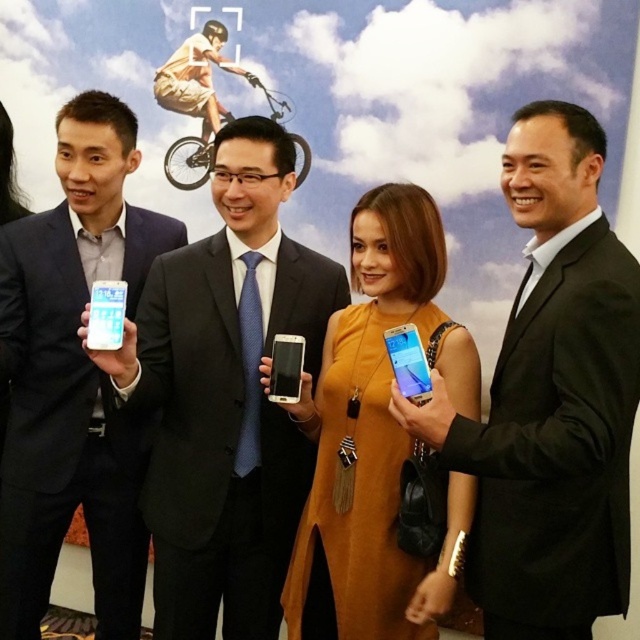
Which of these two, black suit at right or matte black suit at center, stands taller?

matte black suit at center

Does black suit at right have a larger size compared to matte black suit at center?

Incorrect, black suit at right is not larger than matte black suit at center.

Does point (582, 564) come behind point (236, 420)?

No, it is in front of (236, 420).

Where is `black suit at right`? The height and width of the screenshot is (640, 640). black suit at right is located at coordinates pos(552,397).

Is matte black suit at center thinner than orange suede dress at center?

In fact, matte black suit at center might be wider than orange suede dress at center.

Is the position of matte black suit at center less distant than that of orange suede dress at center?

Yes, it is in front of orange suede dress at center.

In the scene shown: Who is more forward, (154, 340) or (394, 220)?

Point (394, 220) is more forward.

I want to click on matte black suit at center, so click(225, 396).

Who is shorter, black suit at right or satin silver smartphone at center?

satin silver smartphone at center

Can you confirm if black suit at right is taller than satin silver smartphone at center?

Yes.

Which is in front, point (554, 179) or point (278, 339)?

Point (554, 179) is in front.

Where is `black suit at right`? black suit at right is located at coordinates [552, 397].